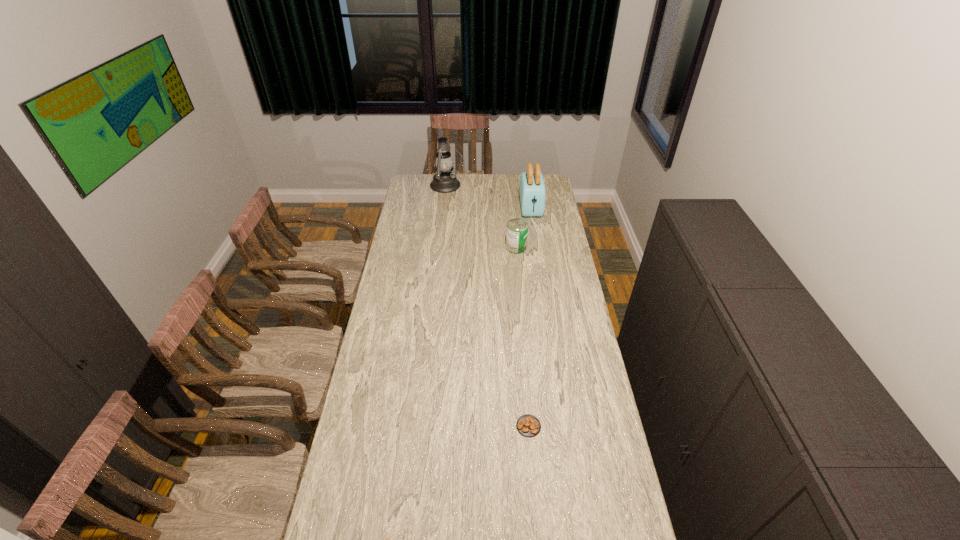
You are a GUI agent. You are given a task and a screenshot of the screen. Output one action in this format:
    pyautogui.click(x=<x>, y=<y>)
    Task: Click on the farthest object
    
    Given the screenshot: What is the action you would take?
    pyautogui.click(x=444, y=181)

I want to click on the tallest object, so click(x=444, y=181).

Where is `the fourth shortest object`? This screenshot has width=960, height=540. the fourth shortest object is located at coordinates (532, 192).

The width and height of the screenshot is (960, 540). What are the coordinates of `the second farthest object` in the screenshot? It's located at (532, 192).

Where is `the third farthest object`? The width and height of the screenshot is (960, 540). the third farthest object is located at coordinates (517, 229).

Locate an element on the screen. This screenshot has width=960, height=540. the third shortest object is located at coordinates (517, 229).

I want to click on the shortest object, so click(x=528, y=425).

The width and height of the screenshot is (960, 540). I want to click on the fourth farthest object, so click(x=528, y=425).

Find the location of a particular element. The width and height of the screenshot is (960, 540). blank area located 0.340m on the right of the farthest object is located at coordinates (520, 186).

Find the location of a particular element. The image size is (960, 540). vacant area located on the side of the second tallest object with the lever is located at coordinates (534, 229).